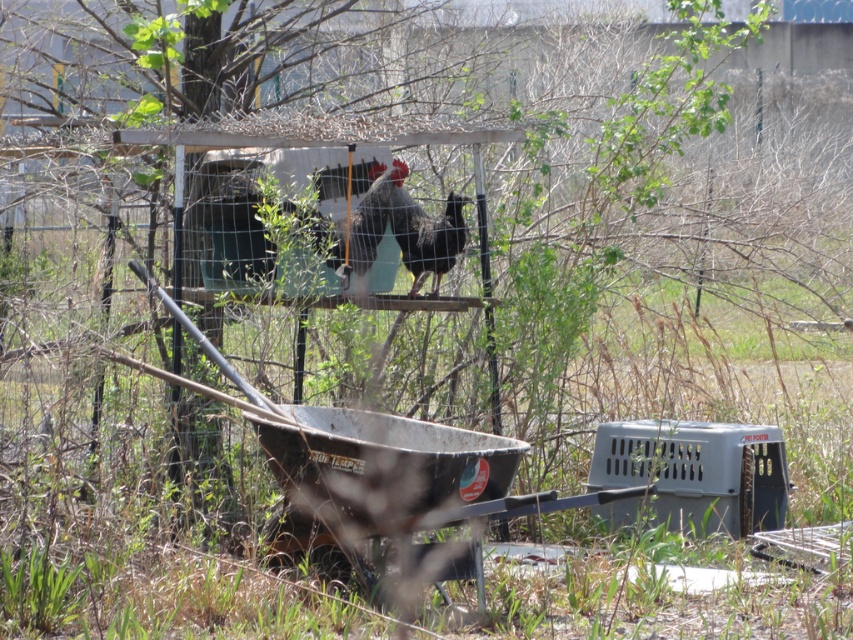
Question: Which of the following is the closest to the observer?

Choices:
 (A) (450, 244)
 (B) (352, 221)

Answer: (B)

Question: Does black glossy rooster at center appear on the left side of silvery metallic rooster at center?

Choices:
 (A) yes
 (B) no

Answer: (B)

Question: Is black glossy rooster at center positioned in front of silvery metallic rooster at center?

Choices:
 (A) no
 (B) yes

Answer: (A)

Question: Which point is farther to the camera?

Choices:
 (A) (416, 241)
 (B) (352, 259)

Answer: (B)

Question: From the image, what is the correct spatial relationship of black glossy rooster at center in relation to silvery metallic rooster at center?

Choices:
 (A) left
 (B) right

Answer: (B)